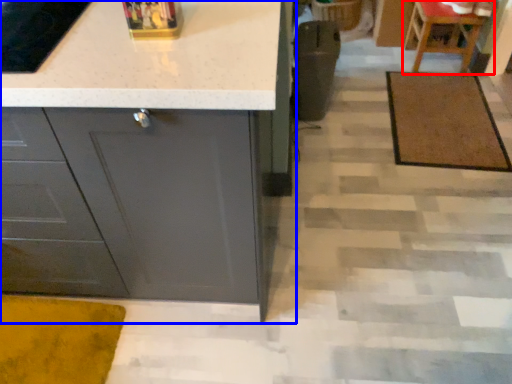
Question: Among these objects, which one is farthest to the camera, chair (highlighted by a red box) or cabinetry (highlighted by a blue box)?

Choices:
 (A) chair
 (B) cabinetry

Answer: (A)